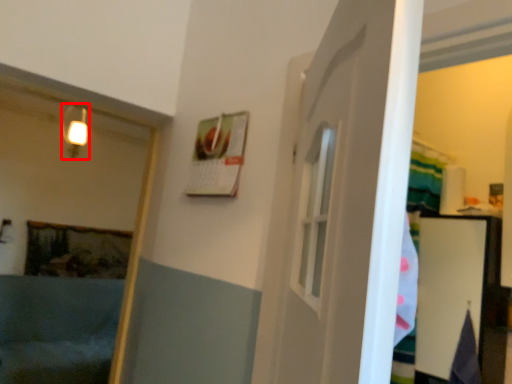
Question: Where is light fixture (annotated by the red box) located in relation to bath in the image?

Choices:
 (A) right
 (B) left

Answer: (A)